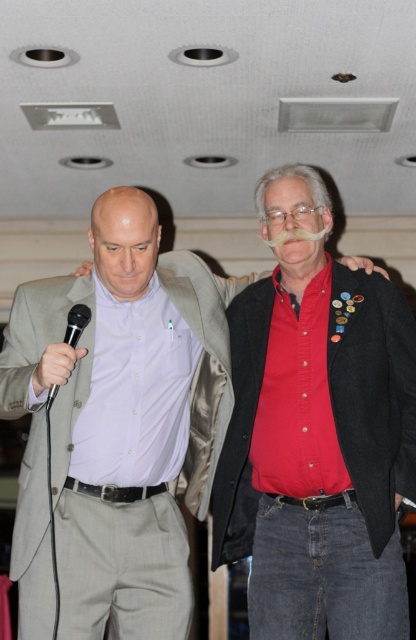
Can you confirm if red matte button-up shirt at center is positioned to the right of red button-up shirt at center?

Yes, red matte button-up shirt at center is to the right of red button-up shirt at center.

Which is in front, point (331, 449) or point (64, 486)?

Point (64, 486) is in front.

Identify the location of red matte button-up shirt at center. The image size is (416, 640). (316, 433).

Where is `red matte button-up shirt at center`? This screenshot has height=640, width=416. red matte button-up shirt at center is located at coordinates (316, 433).

Can you confirm if red button-up shirt at center is thinner than black matte microphone at left?

Incorrect, red button-up shirt at center's width is not less than black matte microphone at left's.

Is red button-up shirt at center positioned behind black matte microphone at left?

That is True.

What are the coordinates of `red button-up shirt at center` in the screenshot? It's located at (121, 419).

Find the location of a particular element. This screenshot has width=416, height=640. red matte button-up shirt at center is located at coordinates (316, 433).

At what (x,y) coordinates should I click in order to perform the action: click on red matte button-up shirt at center. Please return your answer as a coordinate pair (x, y). Looking at the image, I should click on (316, 433).